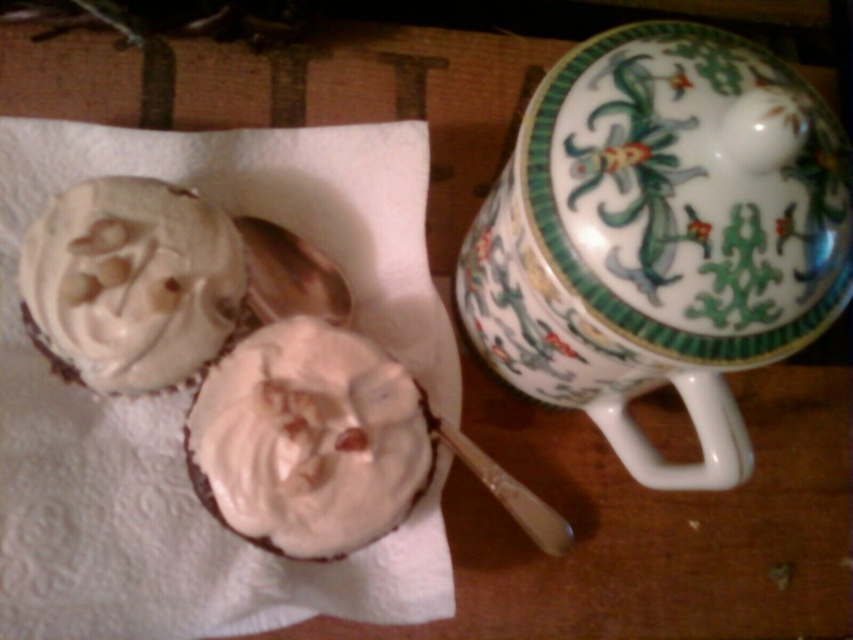
Question: Does white paper towel at upper left come behind whipped cream cupcake at left?

Choices:
 (A) yes
 (B) no

Answer: (A)

Question: Which object is closer to the camera taking this photo?

Choices:
 (A) creamy matte frosting at center
 (B) porcelain mug with floral design at upper center
 (C) white paper towel at upper left

Answer: (B)

Question: Among these points, which one is nearest to the camera?

Choices:
 (A) (383, 192)
 (B) (251, 522)

Answer: (B)

Question: Which object is the farthest from the creamy matte frosting at center?

Choices:
 (A) porcelain mug with floral design at upper center
 (B) white paper towel at upper left

Answer: (A)

Question: Considering the relative positions of white paper towel at upper left and whipped cream cupcake at left in the image provided, where is white paper towel at upper left located with respect to whipped cream cupcake at left?

Choices:
 (A) left
 (B) right

Answer: (B)

Question: Observing the image, what is the correct spatial positioning of porcelain mug with floral design at upper center in reference to whipped cream cupcake at left?

Choices:
 (A) right
 (B) left

Answer: (A)